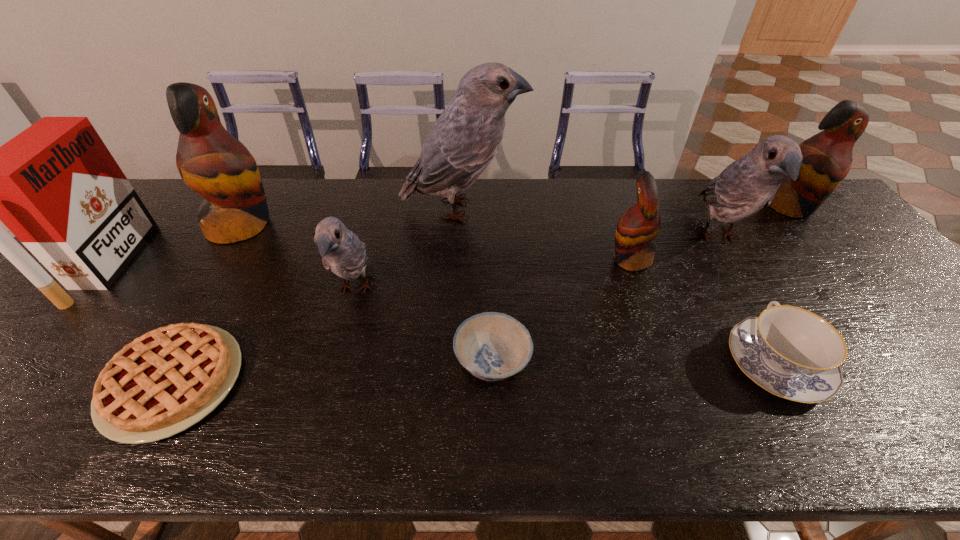
Locate an element on the screen. Image resolution: width=960 pixels, height=540 pixels. free space located with the handle on the side of the blue chinaware is located at coordinates click(x=723, y=266).

At what (x,y) coordinates should I click in order to perform the action: click on free region located 0.140m with the handle on the side of the blue chinaware. Please return your answer as a coordinate pair (x, y). This screenshot has width=960, height=540. Looking at the image, I should click on (732, 282).

Locate an element on the screen. free space located on the right of the second shortest object is located at coordinates (596, 361).

This screenshot has height=540, width=960. Find the location of `vacant area located 0.380m on the back of the shortest object`. vacant area located 0.380m on the back of the shortest object is located at coordinates (256, 229).

I want to click on object present at the near edge, so click(165, 381).

Where is `object that is at the left edge`? Image resolution: width=960 pixels, height=540 pixels. object that is at the left edge is located at coordinates (55, 186).

Locate an element on the screen. object that is at the right edge is located at coordinates (827, 156).

Where is `object present at the far right corner`? The height and width of the screenshot is (540, 960). object present at the far right corner is located at coordinates (x=827, y=156).

Locate an element on the screen. The width and height of the screenshot is (960, 540). free space at the far edge is located at coordinates (550, 216).

What are the coordinates of `vacant space at the near edge of the desktop` in the screenshot? It's located at (701, 427).